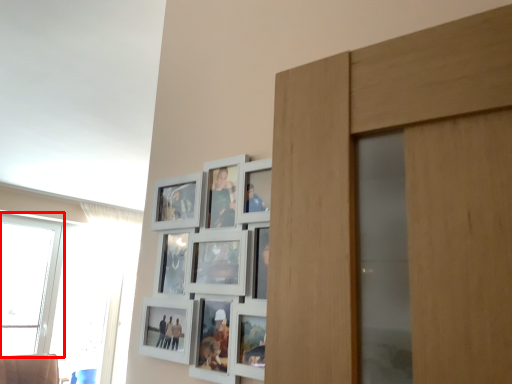
Question: Observing the image, what is the correct spatial positioning of window (annotated by the red box) in reference to window?

Choices:
 (A) right
 (B) left

Answer: (B)